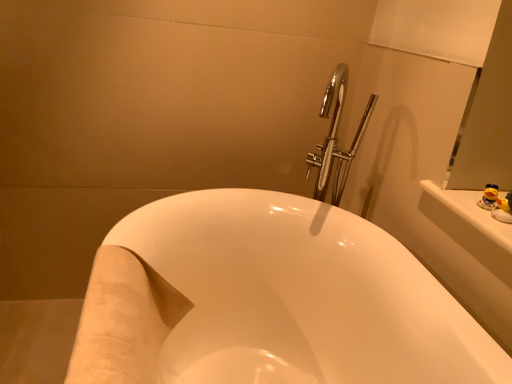
Question: Is white glossy bathtub at center aimed at yellow rubber duck at upper right, arranged as the 1th toy when viewed from the front?

Choices:
 (A) yes
 (B) no

Answer: (B)

Question: Can you confirm if white glossy bathtub at center is wider than yellow rubber duck at upper right, which appears as the 2th toy when viewed from the back?

Choices:
 (A) yes
 (B) no

Answer: (A)

Question: Is the position of white glossy bathtub at center more distant than that of yellow rubber duck at upper right, arranged as the 1th toy when viewed from the front?

Choices:
 (A) yes
 (B) no

Answer: (B)

Question: Considering the relative positions of white glossy bathtub at center and yellow rubber duck at upper right, which appears as the 2th toy when viewed from the back, in the image provided, is white glossy bathtub at center to the left of yellow rubber duck at upper right, which appears as the 2th toy when viewed from the back, from the viewer's perspective?

Choices:
 (A) yes
 (B) no

Answer: (A)

Question: From the image's perspective, is white glossy bathtub at center on yellow rubber duck at upper right, which appears as the 2th toy when viewed from the back?

Choices:
 (A) no
 (B) yes

Answer: (A)

Question: Is yellow rubber duck at upper right, the second toy positioned from the front, in front of or behind white glossy bathtub at center in the image?

Choices:
 (A) behind
 (B) front

Answer: (A)

Question: Looking at their shapes, would you say yellow rubber duck at upper right, the second toy positioned from the front, is wider or thinner than white glossy bathtub at center?

Choices:
 (A) thin
 (B) wide

Answer: (A)

Question: Which is correct: yellow rubber duck at upper right, the second toy positioned from the front, is inside white glossy bathtub at center, or outside of it?

Choices:
 (A) inside
 (B) outside

Answer: (B)

Question: From a real-world perspective, is yellow rubber duck at upper right, the second toy positioned from the front, above or below white glossy bathtub at center?

Choices:
 (A) above
 (B) below

Answer: (A)

Question: In terms of size, does yellow rubber duck at upper right, which appears as the 2th toy when viewed from the back, appear bigger or smaller than white glossy bathtub at center?

Choices:
 (A) small
 (B) big

Answer: (A)

Question: Does point (497, 205) appear closer or farther from the camera than point (440, 352)?

Choices:
 (A) closer
 (B) farther

Answer: (B)

Question: From the image's perspective, is yellow rubber duck at upper right, arranged as the 1th toy when viewed from the front, above or below white glossy bathtub at center?

Choices:
 (A) above
 (B) below

Answer: (A)

Question: Is yellow rubber duck at upper right, which appears as the 2th toy when viewed from the back, wider or thinner than white glossy bathtub at center?

Choices:
 (A) thin
 (B) wide

Answer: (A)

Question: Considering the positions of white glossy bathtub at center and yellow rubber duck at upper right, which appears as the 2th toy when viewed from the back, in the image, is white glossy bathtub at center wider or thinner than yellow rubber duck at upper right, which appears as the 2th toy when viewed from the back,?

Choices:
 (A) wide
 (B) thin

Answer: (A)

Question: From a real-world perspective, relative to yellow rubber duck at upper right, which appears as the 2th toy when viewed from the back, is white glossy bathtub at center vertically above or below?

Choices:
 (A) below
 (B) above

Answer: (A)